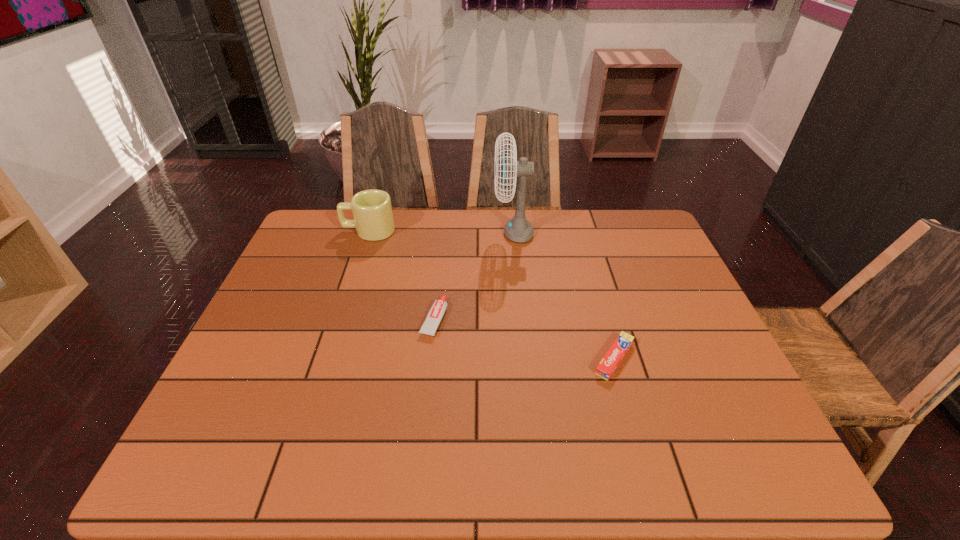
Where is `free spot located with the handle on the side of the mug`? free spot located with the handle on the side of the mug is located at coordinates (324, 231).

Locate an element on the screen. The width and height of the screenshot is (960, 540). free point located on the right of the left toothpaste is located at coordinates (502, 319).

At what (x,y) coordinates should I click in order to perform the action: click on free space located 0.190m on the left of the shortest object. Please return your answer as a coordinate pair (x, y). Looking at the image, I should click on click(510, 359).

This screenshot has height=540, width=960. I want to click on fan positioned at the far edge, so click(x=518, y=229).

The height and width of the screenshot is (540, 960). Find the location of `mug at the far edge`. mug at the far edge is located at coordinates (373, 218).

The width and height of the screenshot is (960, 540). What are the coordinates of `object that is positioned at the left edge` in the screenshot? It's located at (373, 218).

The image size is (960, 540). I want to click on object that is positioned at the far left corner, so click(x=373, y=218).

You are a GUI agent. You are given a task and a screenshot of the screen. Output one action in this format:
    pyautogui.click(x=<x>, y=<y>)
    Task: Click on the vacant position at the far edge of the desktop
    Image resolution: width=960 pixels, height=540 pixels.
    Given the screenshot: What is the action you would take?
    pyautogui.click(x=421, y=243)

You are a GUI agent. You are given a task and a screenshot of the screen. Output one action in this format:
    pyautogui.click(x=<x>, y=<y>)
    Task: Click on the vacant point at the near edge
    
    Given the screenshot: What is the action you would take?
    pyautogui.click(x=432, y=470)

This screenshot has height=540, width=960. I want to click on vacant space at the left edge of the desktop, so click(x=204, y=415).